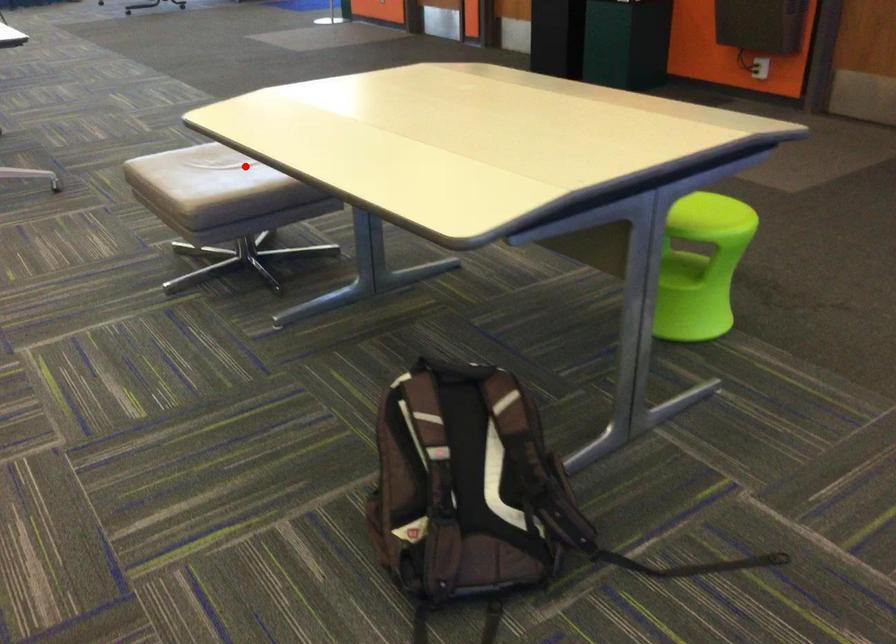
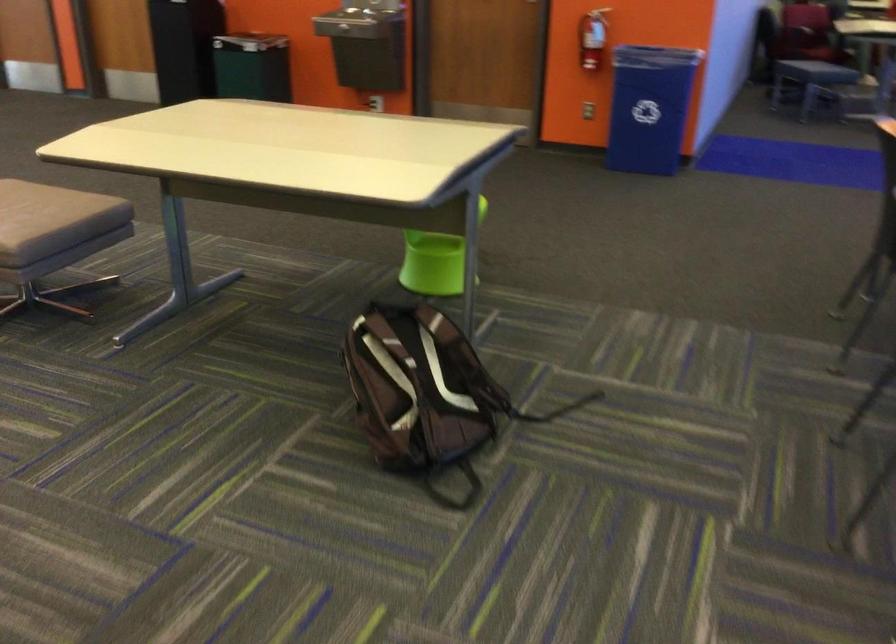
Find the pixel in the second image that matches the highlighted location in the first image.

(39, 203)